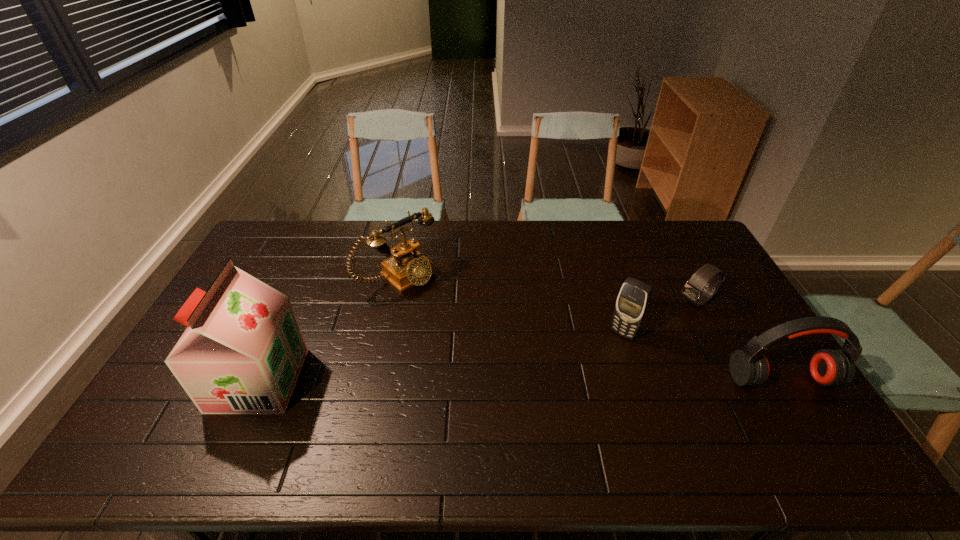
Image resolution: width=960 pixels, height=540 pixels. I want to click on vacant spot on the desktop that is between the tallest object and the earphone and is positioned on the front face of the third object from left to right, so click(x=588, y=380).

This screenshot has height=540, width=960. What are the coordinates of `free space on the desktop that is between the tallest object and the earphone and is positioned on the dial number of the second object from left to right` in the screenshot? It's located at pyautogui.click(x=517, y=380).

The width and height of the screenshot is (960, 540). Identify the location of free spot on the desktop that is between the soya milk and the earphone and is positioned on the face of the shortest object. (574, 380).